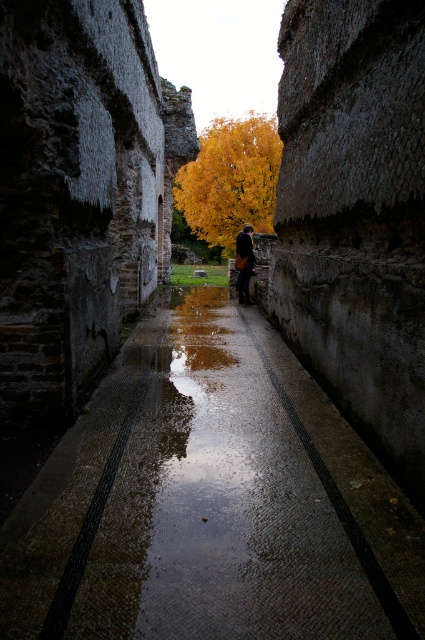
You are standing at the entrance of the corridor and see a yellow leafy tree at center and a leather brown bag at center. Which object is closer to you?

The yellow leafy tree at center is closer to you because it is 23.50 meters away from the leather brown bag at center, so the tree is nearer than the bag.

You are standing in the corridor and see a point marked at coordinates (210, 500). What is located at that point?

The wet concrete pavement at center is located at point (210, 500).

You are a delivery person carrying a package that is 3 feet wide. You are standing in the corridor and see the wet concrete pavement at center and the leather brown bag at center. Can you safely pass between them without hitting your package against the walls?

The distance between the wet concrete pavement at center and the leather brown bag at center is 38.05 feet. Since your package is only 3 feet wide, there is more than enough space to pass safely between them without hitting the walls.